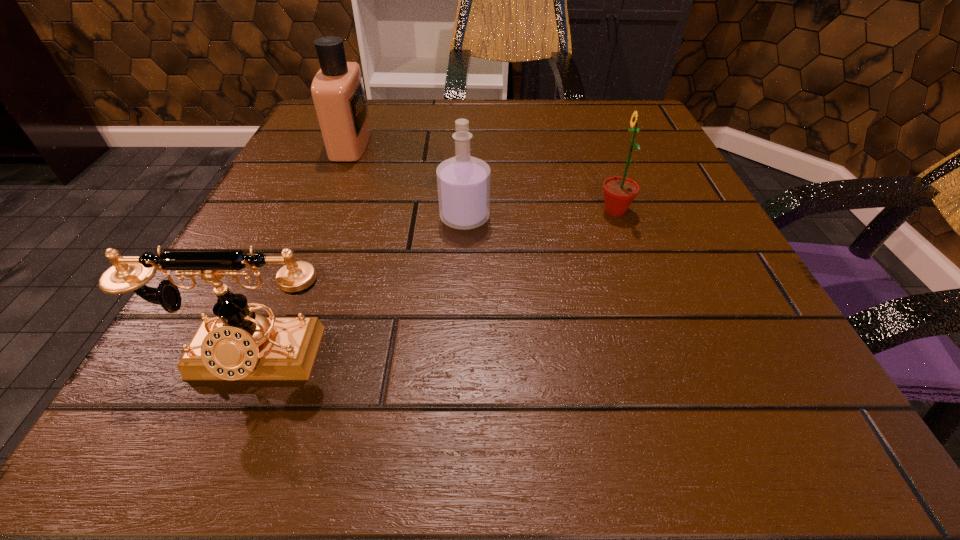
What are the coordinates of `vacant space at the right edge` in the screenshot? It's located at (658, 278).

In the image, there is a desktop. Identify the location of free space at the far left corner. (307, 134).

You are a GUI agent. You are given a task and a screenshot of the screen. Output one action in this format:
    pyautogui.click(x=<x>, y=<y>)
    Task: Click on the vacant space at the near left corner of the desktop
    The height and width of the screenshot is (540, 960).
    Given the screenshot: What is the action you would take?
    pyautogui.click(x=147, y=447)

Identify the location of free space at the near right corner of the desktop. Image resolution: width=960 pixels, height=540 pixels. (828, 409).

Locate an element on the screen. This screenshot has height=540, width=960. vacant area that lies between the rightmost object and the telephone is located at coordinates (433, 285).

Where is `vacant space that's between the rightmost object and the nearer perfume`? This screenshot has height=540, width=960. vacant space that's between the rightmost object and the nearer perfume is located at coordinates (540, 214).

You are a GUI agent. You are given a task and a screenshot of the screen. Output one action in this format:
    pyautogui.click(x=<x>, y=<y>)
    Task: Click on the free area in between the rightmost object and the telephone
    
    Given the screenshot: What is the action you would take?
    pyautogui.click(x=433, y=285)

Locate an element on the screen. The height and width of the screenshot is (540, 960). vacant point located between the left perfume and the nearest object is located at coordinates (301, 251).

Find the location of a particular element. The width and height of the screenshot is (960, 540). vacant point located between the nearer perfume and the nearest object is located at coordinates (358, 288).

The image size is (960, 540). I want to click on empty space between the nearest object and the left perfume, so click(301, 251).